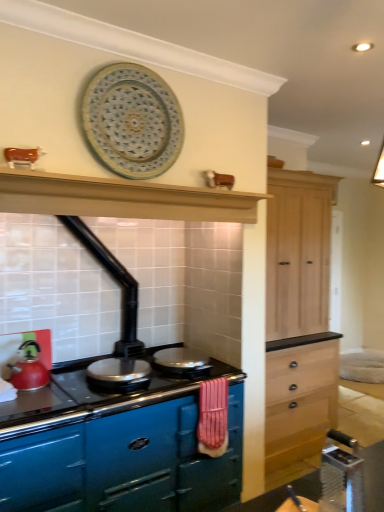
Question: Is metallic silver table at lower right wider than matte red kettle at left?

Choices:
 (A) no
 (B) yes

Answer: (A)

Question: Considering the relative sizes of metallic silver table at lower right and matte red kettle at left in the image provided, is metallic silver table at lower right bigger than matte red kettle at left?

Choices:
 (A) no
 (B) yes

Answer: (A)

Question: Does metallic silver table at lower right lie behind matte red kettle at left?

Choices:
 (A) yes
 (B) no

Answer: (B)

Question: Does metallic silver table at lower right have a smaller size compared to matte red kettle at left?

Choices:
 (A) yes
 (B) no

Answer: (A)

Question: From the image's perspective, does metallic silver table at lower right appear lower than matte red kettle at left?

Choices:
 (A) yes
 (B) no

Answer: (B)

Question: Considering the relative positions of metallic silver table at lower right and matte red kettle at left in the image provided, is metallic silver table at lower right to the right of matte red kettle at left from the viewer's perspective?

Choices:
 (A) yes
 (B) no

Answer: (A)

Question: Would you say glossy enamel stove at center is a long distance from matte black exhaust hood at upper center?

Choices:
 (A) no
 (B) yes

Answer: (B)

Question: Considering the relative sizes of glossy enamel stove at center and matte black exhaust hood at upper center in the image provided, is glossy enamel stove at center smaller than matte black exhaust hood at upper center?

Choices:
 (A) no
 (B) yes

Answer: (A)

Question: Is glossy enamel stove at center wider than matte black exhaust hood at upper center?

Choices:
 (A) yes
 (B) no

Answer: (A)

Question: From a real-world perspective, is glossy enamel stove at center physically above matte black exhaust hood at upper center?

Choices:
 (A) yes
 (B) no

Answer: (B)

Question: From the image's perspective, is glossy enamel stove at center below matte black exhaust hood at upper center?

Choices:
 (A) yes
 (B) no

Answer: (A)

Question: Can you confirm if glossy enamel stove at center is bigger than matte black exhaust hood at upper center?

Choices:
 (A) no
 (B) yes

Answer: (B)

Question: From the image's perspective, is glossy enamel stove at center over blue ceramic platter at upper center?

Choices:
 (A) no
 (B) yes

Answer: (A)